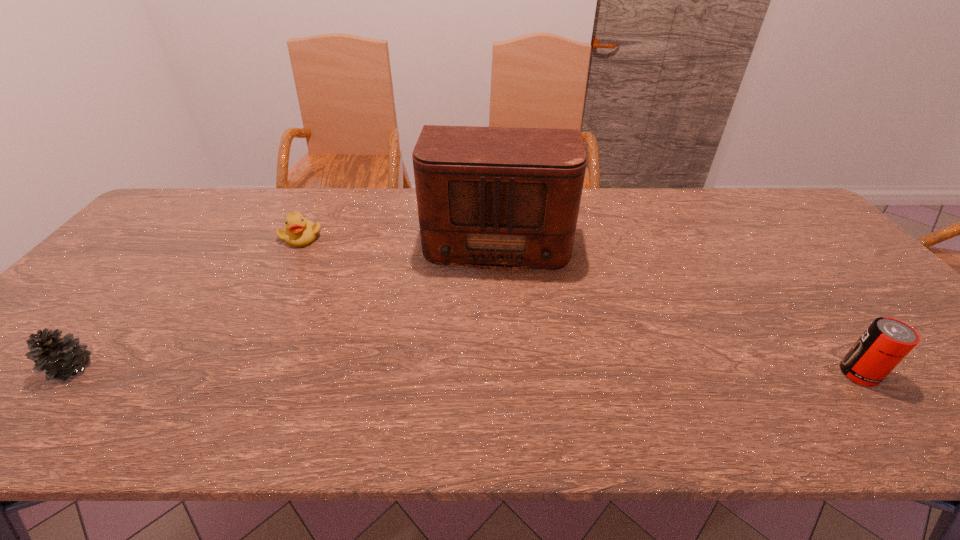
Identify the location of object at the left edge. This screenshot has width=960, height=540. (60, 358).

Locate an element on the screen. object that is positioned at the near left corner is located at coordinates (60, 358).

At what (x,y) coordinates should I click in order to perform the action: click on free space at the far edge of the desktop. Please return your answer as a coordinate pair (x, y). The width and height of the screenshot is (960, 540). Looking at the image, I should click on [x=730, y=212].

I want to click on blank space at the near edge of the desktop, so click(x=229, y=377).

Where is `free region at the right edge of the desktop`? free region at the right edge of the desktop is located at coordinates (814, 233).

Where is `vacant space that's between the rightmost object and the tallest object`? vacant space that's between the rightmost object and the tallest object is located at coordinates (678, 306).

I want to click on empty space that is in between the duckling and the rightmost object, so click(580, 305).

At what (x,y) coordinates should I click in order to perform the action: click on free spot between the tallest object and the third shortest object. Please return your answer as a coordinate pair (x, y). The image size is (960, 540). Looking at the image, I should click on (678, 306).

I want to click on free space between the second object from right to left and the can, so click(678, 306).

The width and height of the screenshot is (960, 540). Identify the location of blank region between the can and the pinecone. (466, 371).